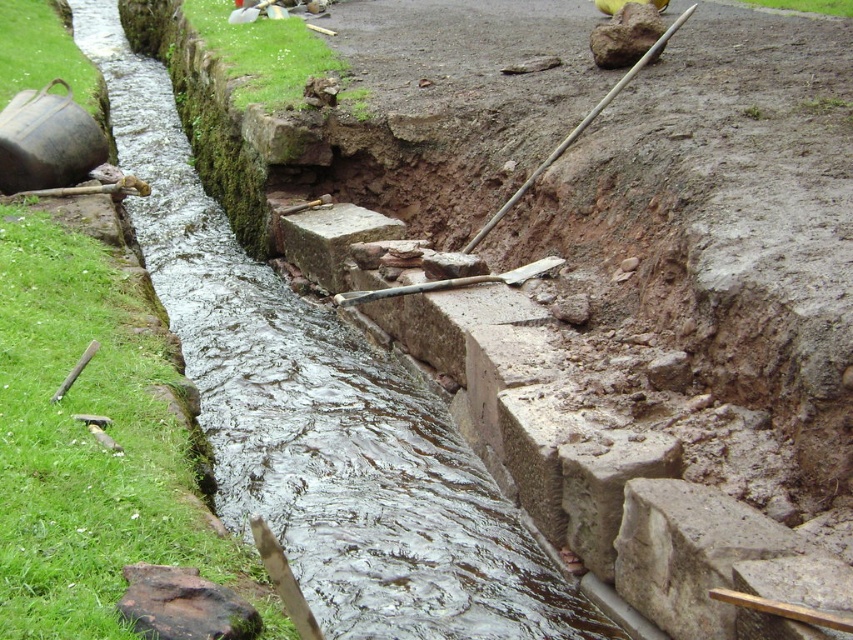
Can you confirm if wet concrete stream at center is positioned to the right of smooth wooden shovel at upper right?

In fact, wet concrete stream at center is to the left of smooth wooden shovel at upper right.

Is wet concrete stream at center positioned before smooth wooden shovel at upper right?

Yes, wet concrete stream at center is closer to the viewer.

Where is `wet concrete stream at center`? wet concrete stream at center is located at coordinates (321, 417).

Does smooth wooden shovel at upper right appear on the right side of wooden shovel at center?

Yes, smooth wooden shovel at upper right is to the right of wooden shovel at center.

Can you confirm if smooth wooden shovel at upper right is taller than wooden shovel at center?

No.

Between point (585, 125) and point (556, 260), which one is positioned in front?

Point (556, 260) is in front.

You are a GUI agent. You are given a task and a screenshot of the screen. Output one action in this format:
    pyautogui.click(x=<x>, y=<y>)
    Task: Click on the smooth wooden shovel at upper right
    
    Given the screenshot: What is the action you would take?
    pyautogui.click(x=579, y=128)

Looking at this image, which is more to the right, wet concrete stream at center or wooden shovel at center?

From the viewer's perspective, wooden shovel at center appears more on the right side.

Which is behind, point (485, 472) or point (561, 262)?

Point (561, 262)

Which is behind, point (379, 577) or point (494, 278)?

The point (494, 278) is behind.

The image size is (853, 640). I want to click on wet concrete stream at center, so click(321, 417).